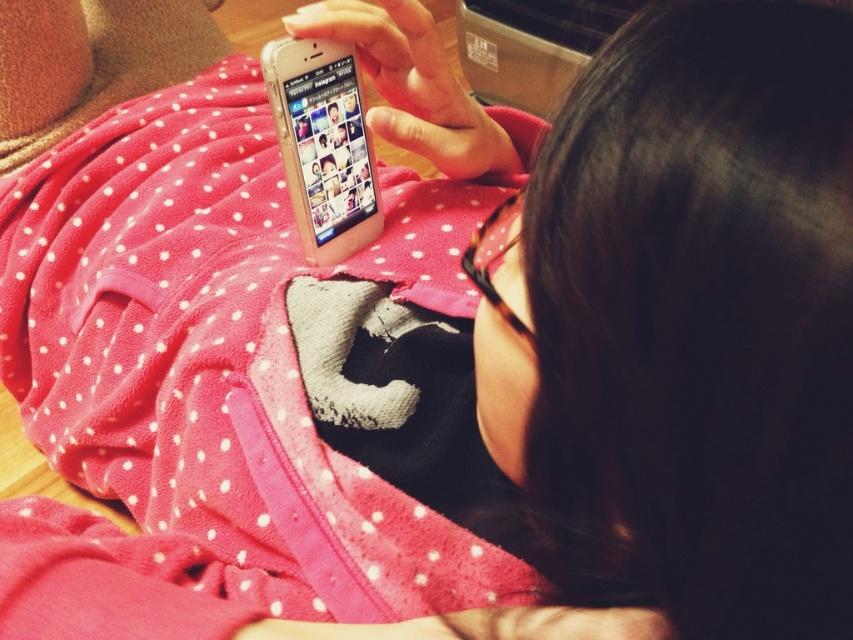
Question: Among these objects, which one is nearest to the camera?

Choices:
 (A) pink fleece blanket at center
 (B) clear plastic phone at center

Answer: (A)

Question: Is pink fleece blanket at center bigger than clear plastic phone at center?

Choices:
 (A) no
 (B) yes

Answer: (B)

Question: Which point appears farthest from the camera in this image?

Choices:
 (A) (331, 248)
 (B) (210, 260)

Answer: (B)

Question: Is pink fleece blanket at center further to camera compared to clear plastic phone at center?

Choices:
 (A) no
 (B) yes

Answer: (A)

Question: Which point is farther to the camera?

Choices:
 (A) pink fleece blanket at center
 (B) clear plastic phone at center

Answer: (B)

Question: Can you confirm if pink fleece blanket at center is positioned above clear plastic phone at center?

Choices:
 (A) yes
 (B) no

Answer: (B)